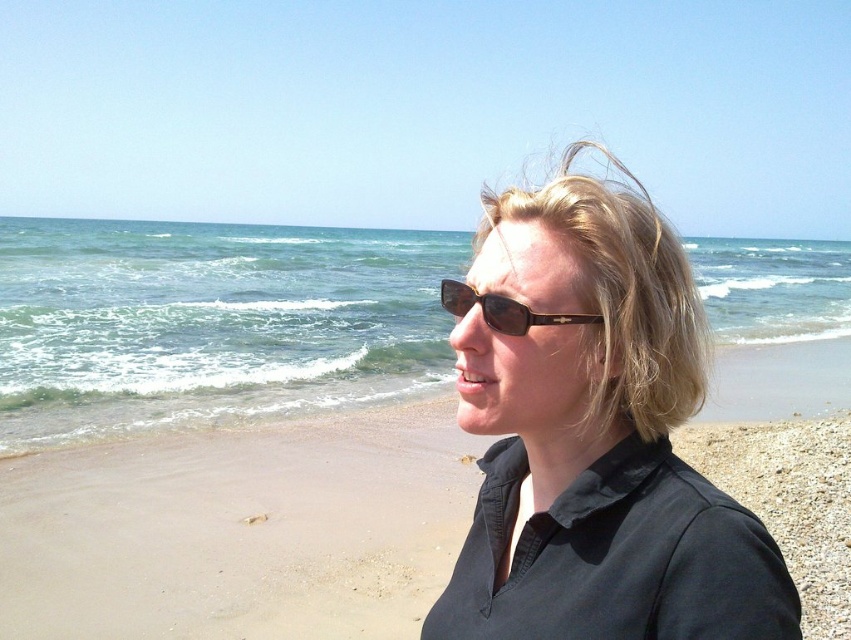
What do you see at coordinates (592, 436) in the screenshot?
I see `matte black shirt at center` at bounding box center [592, 436].

Can you confirm if matte black shirt at center is bigger than sandy beach at lower right?

Incorrect, matte black shirt at center is not larger than sandy beach at lower right.

Measure the distance between point (649, 460) and camera.

Point (649, 460) is 90.85 centimeters away from camera.

At what (x,y) coordinates should I click in order to perform the action: click on matte black shirt at center. Please return your answer as a coordinate pair (x, y). Looking at the image, I should click on [x=592, y=436].

Who is shorter, sandy beach at lower right or sunglasses at center?

sunglasses at center is shorter.

Who is more forward, [263,563] or [523,314]?

Point [523,314] is more forward.

The width and height of the screenshot is (851, 640). Find the location of `sandy beach at lower right`. sandy beach at lower right is located at coordinates (238, 531).

Consider the image. Who is more distant from viewer, (607, 218) or (513, 300)?

Point (607, 218)

Is matte black shirt at center to the left of sunglasses at center from the viewer's perspective?

Incorrect, matte black shirt at center is not on the left side of sunglasses at center.

Image resolution: width=851 pixels, height=640 pixels. Describe the element at coordinates (592, 436) in the screenshot. I see `matte black shirt at center` at that location.

Where is `matte black shirt at center`? The width and height of the screenshot is (851, 640). matte black shirt at center is located at coordinates (592, 436).